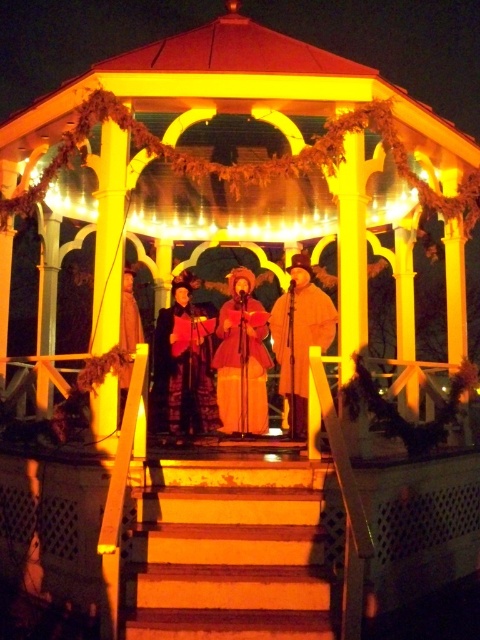
Is yellow wood gazebo at center to the right of velvet red dress at center from the viewer's perspective?

Yes, yellow wood gazebo at center is to the right of velvet red dress at center.

Between yellow wood gazebo at center and velvet red dress at center, which one is positioned higher?

Positioned higher is yellow wood gazebo at center.

Which is in front, point (11, 182) or point (173, 348)?

Point (11, 182) is in front.

You are a GUI agent. You are given a task and a screenshot of the screen. Output one action in this format:
    pyautogui.click(x=<x>, y=<y>)
    Task: Click on the yellow wood gazebo at center
    This screenshot has width=480, height=640.
    Given the screenshot: What is the action you would take?
    pyautogui.click(x=244, y=182)

Does velvet red dress at center have a lesser height compared to matte brown coat at center?

In fact, velvet red dress at center may be taller than matte brown coat at center.

Between velvet red dress at center and matte brown coat at center, which one has more height?

With more height is velvet red dress at center.

Describe the element at coordinates (183, 368) in the screenshot. This screenshot has width=480, height=640. I see `velvet red dress at center` at that location.

This screenshot has height=640, width=480. I want to click on velvet red dress at center, so click(x=183, y=368).

Consider the image. Who is taller, wooden stairs at center or velvet red dress at center?

velvet red dress at center

Does point (232, 572) come in front of point (194, 342)?

Yes, it is in front of point (194, 342).

At what (x,y) coordinates should I click in order to perform the action: click on wooden stairs at center. Please return your answer as a coordinate pair (x, y). This screenshot has width=480, height=640. Looking at the image, I should click on pos(228,552).